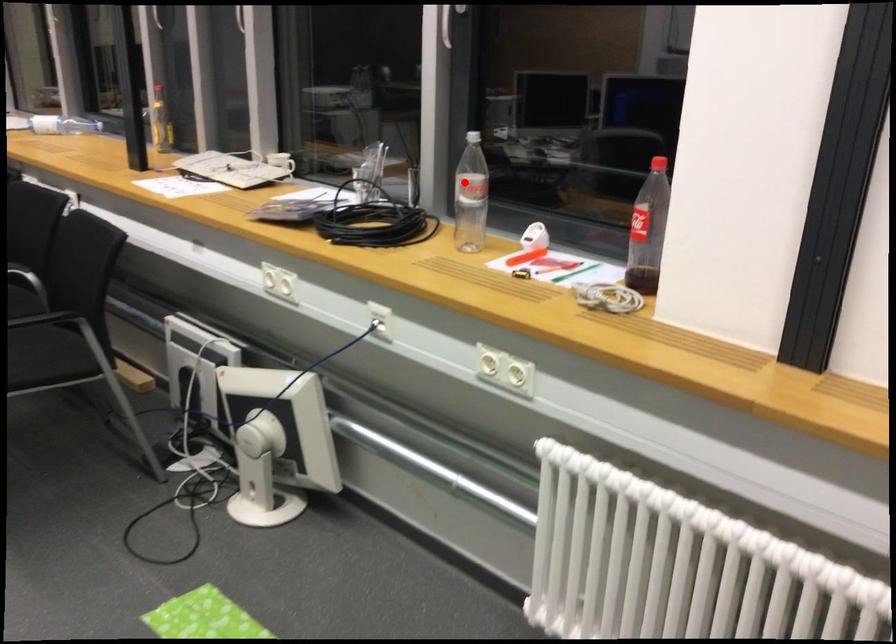
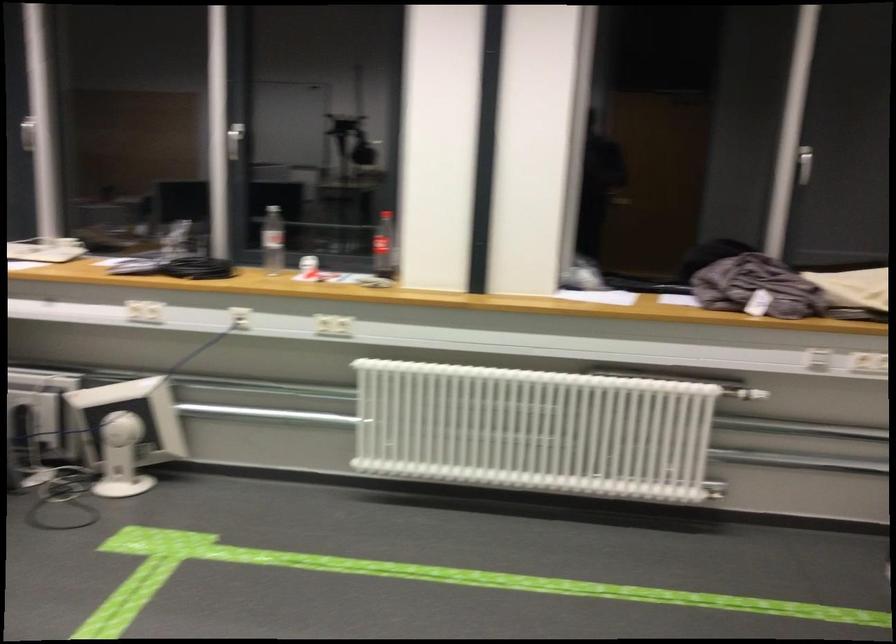
Locate, in the second image, the point that corresponds to the highlighted location in the first image.

(271, 240)